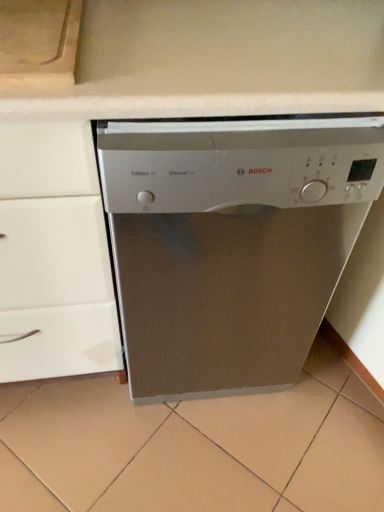
Identify the location of satin silver dishwasher at center. Image resolution: width=384 pixels, height=512 pixels. (231, 243).

The width and height of the screenshot is (384, 512). What do you see at coordinates (231, 243) in the screenshot?
I see `satin silver dishwasher at center` at bounding box center [231, 243].

Identify the location of satin silver dishwasher at center. (231, 243).